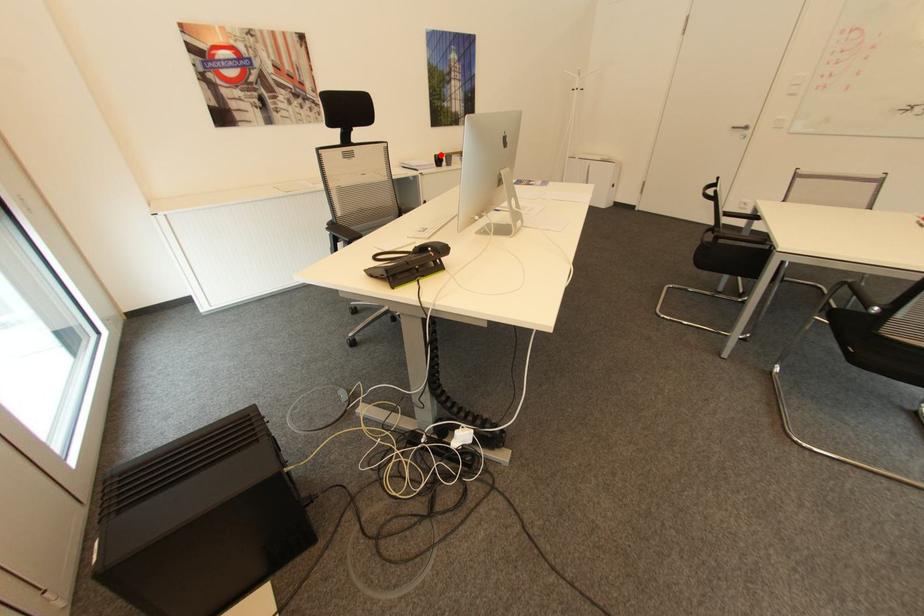
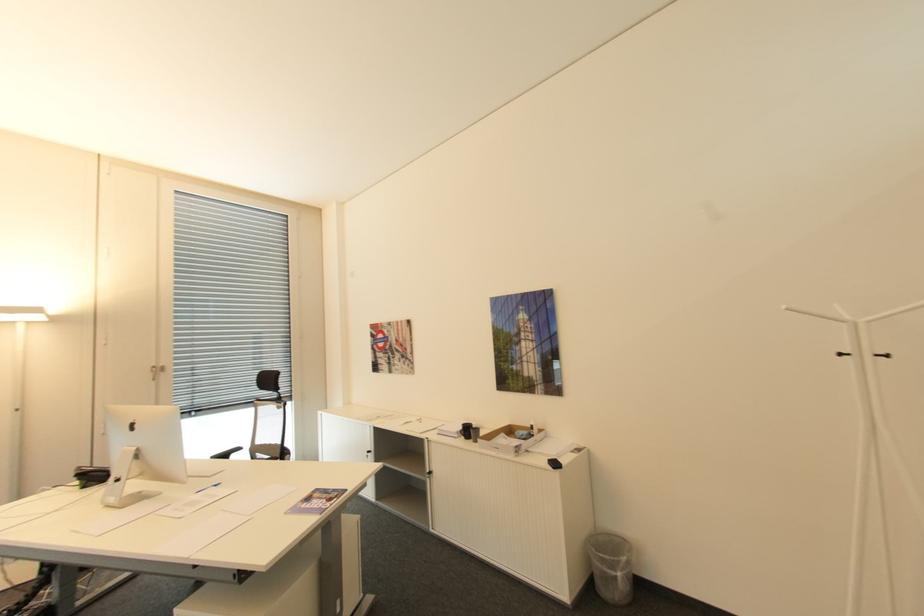
Question: I am providing you with two images of the same scene from different viewpoints. In image1, a red point is highlighted. Considering the same 3D point in image2, which of the following is correct?

Choices:
 (A) It is closer
 (B) It is farther

Answer: (B)